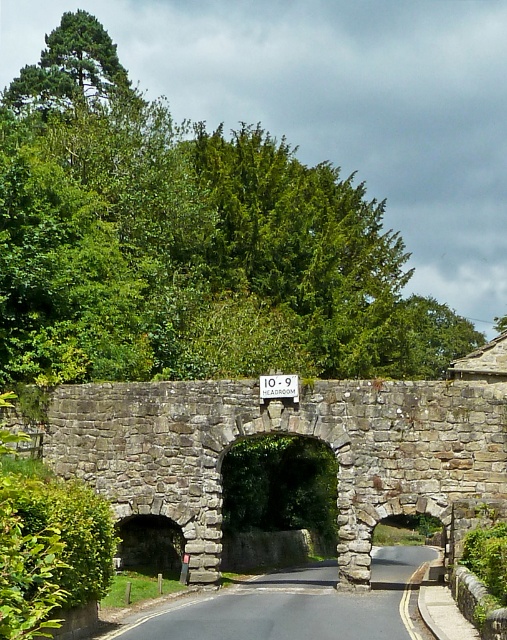
Question: Can you confirm if stone archway at center is smaller than green stone archway at center?

Choices:
 (A) yes
 (B) no

Answer: (A)

Question: Which point is closer to the camera?

Choices:
 (A) (307, 465)
 (B) (277, 381)
 (C) (453, 422)

Answer: (C)

Question: Among these objects, which one is farthest from the camera?

Choices:
 (A) white plastic sign at center
 (B) green stone archway at center
 (C) stone archway at center

Answer: (B)

Question: Is stone archway at center below green stone archway at center?

Choices:
 (A) yes
 (B) no

Answer: (B)

Question: Which object appears closest to the camera in this image?

Choices:
 (A) stone archway at center
 (B) white plastic sign at center
 (C) green stone archway at center

Answer: (A)

Question: Does stone archway at center appear under green stone archway at center?

Choices:
 (A) yes
 (B) no

Answer: (B)